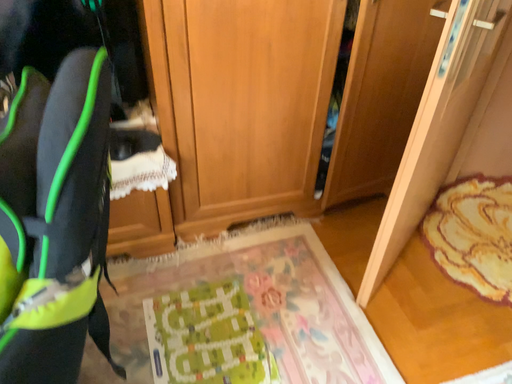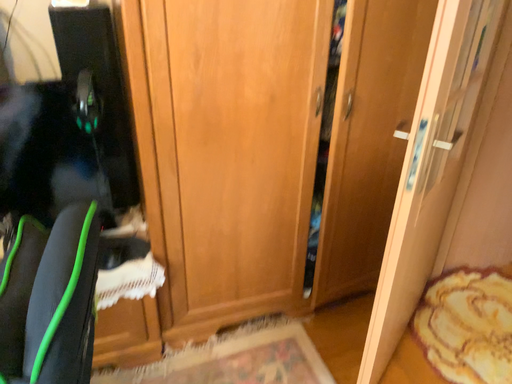
Question: Which way did the camera rotate in the video?

Choices:
 (A) rotated downward
 (B) rotated upward

Answer: (B)